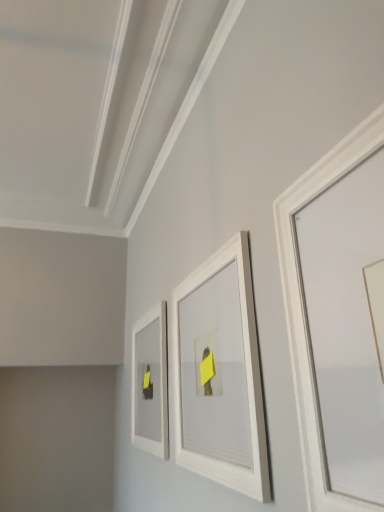
What do you see at coordinates (220, 374) in the screenshot? The width and height of the screenshot is (384, 512). I see `white matte picture frame at center, the second picture frame positioned from the front` at bounding box center [220, 374].

Locate an element on the screen. This screenshot has height=512, width=384. white matte picture frame at center-left, the 1th picture frame positioned from the back is located at coordinates (150, 382).

In order to face white matte picture frame at center-left, marked as the 3th picture frame in a right-to-left arrangement, should I rotate leftwards or rightwards?

To align with it, rotate left about 6.307°.

In order to click on white matte picture frame at center, which is the 2th picture frame in back-to-front order in this screenshot , I will do `click(220, 374)`.

Based on the photo, are white matte picture frame at center-left, the 1th picture frame positioned from the back, and white matte picture frame at upper right, which is the third picture frame from left to right, making contact?

There is a gap between white matte picture frame at center-left, the 1th picture frame positioned from the back, and white matte picture frame at upper right, which is the third picture frame from left to right.

Who is bigger, white matte picture frame at center-left, marked as the 3th picture frame in a right-to-left arrangement, or white matte picture frame at upper right, the third picture frame viewed from the back?

white matte picture frame at center-left, marked as the 3th picture frame in a right-to-left arrangement.

Which is behind, white matte picture frame at center-left, marked as the 3th picture frame in a right-to-left arrangement, or white matte picture frame at upper right, the third picture frame viewed from the back?

Positioned behind is white matte picture frame at center-left, marked as the 3th picture frame in a right-to-left arrangement.

From the image's perspective, is white matte picture frame at center, placed as the 2th picture frame when sorted from right to left, beneath white matte picture frame at upper right, which is the third picture frame from left to right?

Indeed, from the image's perspective, white matte picture frame at center, placed as the 2th picture frame when sorted from right to left, is shown beneath white matte picture frame at upper right, which is the third picture frame from left to right.

Is white matte picture frame at center, which is the 2th picture frame in back-to-front order, far from white matte picture frame at upper right, which is the third picture frame from left to right?

white matte picture frame at center, which is the 2th picture frame in back-to-front order, is near white matte picture frame at upper right, which is the third picture frame from left to right, not far away.

Is white matte picture frame at center, the second picture frame positioned from the front, aimed at white matte picture frame at upper right, which appears as the first picture frame when viewed from the front?

No, white matte picture frame at center, the second picture frame positioned from the front, is not facing towards white matte picture frame at upper right, which appears as the first picture frame when viewed from the front.

At what (x,y) coordinates should I click in order to perform the action: click on picture frame in front of the white matte picture frame at center, placed as the 2th picture frame when sorted from right to left. Please return your answer as a coordinate pair (x, y). This screenshot has height=512, width=384. Looking at the image, I should click on (303, 306).

Which is more to the left, white matte picture frame at center-left, marked as the 3th picture frame in a right-to-left arrangement, or white matte picture frame at center, which is the 2th picture frame in back-to-front order?

From the viewer's perspective, white matte picture frame at center-left, marked as the 3th picture frame in a right-to-left arrangement, appears more on the left side.

How different are the orientations of white matte picture frame at center-left, which is counted as the 1th picture frame, starting from the left, and white matte picture frame at center, arranged as the 2th picture frame when viewed from the left, in degrees?

There is a 0.123-degree angle between the facing directions of white matte picture frame at center-left, which is counted as the 1th picture frame, starting from the left, and white matte picture frame at center, arranged as the 2th picture frame when viewed from the left.

Where is `the 1st picture frame located above the white matte picture frame at center-left, the 1th picture frame positioned from the back (from a real-world perspective)`? the 1st picture frame located above the white matte picture frame at center-left, the 1th picture frame positioned from the back (from a real-world perspective) is located at coordinates (220, 374).

Is the surface of white matte picture frame at center-left, acting as the third picture frame starting from the front, in direct contact with white matte picture frame at center, the second picture frame positioned from the front?

white matte picture frame at center-left, acting as the third picture frame starting from the front, is not next to white matte picture frame at center, the second picture frame positioned from the front, and they're not touching.

Which of these two, white matte picture frame at upper right, the third picture frame viewed from the back, or white matte picture frame at center, arranged as the 2th picture frame when viewed from the left, stands taller?

With more height is white matte picture frame at center, arranged as the 2th picture frame when viewed from the left.

From the image's perspective, which one is positioned lower, white matte picture frame at upper right, which appears as the first picture frame when viewed from the front, or white matte picture frame at center, which is the 2th picture frame in back-to-front order?

white matte picture frame at center, which is the 2th picture frame in back-to-front order.

This screenshot has width=384, height=512. I want to click on picture frame above the white matte picture frame at center, which is the 2th picture frame in back-to-front order (from a real-world perspective), so click(x=303, y=306).

Looking at this image, which of these two, white matte picture frame at upper right, which is the third picture frame from left to right, or white matte picture frame at center, placed as the 2th picture frame when sorted from right to left, is wider?

Wider between the two is white matte picture frame at center, placed as the 2th picture frame when sorted from right to left.

Are white matte picture frame at center, arranged as the 2th picture frame when viewed from the left, and white matte picture frame at center-left, the 1th picture frame positioned from the back, beside each other?

No, white matte picture frame at center, arranged as the 2th picture frame when viewed from the left, is not beside white matte picture frame at center-left, the 1th picture frame positioned from the back.

Considering the sizes of objects white matte picture frame at center, which is the 2th picture frame in back-to-front order, and white matte picture frame at center-left, marked as the 3th picture frame in a right-to-left arrangement, in the image provided, who is smaller, white matte picture frame at center, which is the 2th picture frame in back-to-front order, or white matte picture frame at center-left, marked as the 3th picture frame in a right-to-left arrangement,?

white matte picture frame at center-left, marked as the 3th picture frame in a right-to-left arrangement, is smaller.

Is white matte picture frame at center, which is the 2th picture frame in back-to-front order, looking in the opposite direction of white matte picture frame at center-left, marked as the 3th picture frame in a right-to-left arrangement?

That's not correct — white matte picture frame at center, which is the 2th picture frame in back-to-front order, is not looking away from white matte picture frame at center-left, marked as the 3th picture frame in a right-to-left arrangement.

Is white matte picture frame at center, arranged as the 2th picture frame when viewed from the left, inside the boundaries of white matte picture frame at center-left, the 1th picture frame positioned from the back, or outside?

white matte picture frame at center, arranged as the 2th picture frame when viewed from the left, is outside white matte picture frame at center-left, the 1th picture frame positioned from the back.

Is white matte picture frame at upper right, the first picture frame when ordered from right to left, outside of white matte picture frame at center-left, marked as the 3th picture frame in a right-to-left arrangement?

Yes, white matte picture frame at upper right, the first picture frame when ordered from right to left, is outside of white matte picture frame at center-left, marked as the 3th picture frame in a right-to-left arrangement.

Which object is positioned more to the left, white matte picture frame at upper right, which is the third picture frame from left to right, or white matte picture frame at center-left, which is counted as the 1th picture frame, starting from the left?

Positioned to the left is white matte picture frame at center-left, which is counted as the 1th picture frame, starting from the left.

Is white matte picture frame at upper right, the third picture frame viewed from the back, taller or shorter than white matte picture frame at center-left, acting as the third picture frame starting from the front?

Clearly, white matte picture frame at upper right, the third picture frame viewed from the back, is shorter compared to white matte picture frame at center-left, acting as the third picture frame starting from the front.

Between white matte picture frame at upper right, the third picture frame viewed from the back, and white matte picture frame at center-left, marked as the 3th picture frame in a right-to-left arrangement, which one has larger size?

white matte picture frame at center-left, marked as the 3th picture frame in a right-to-left arrangement.

Image resolution: width=384 pixels, height=512 pixels. What are the coordinates of `the 2nd picture frame counting from the right of the white matte picture frame at center-left, marked as the 3th picture frame in a right-to-left arrangement` in the screenshot? It's located at (303, 306).

This screenshot has width=384, height=512. I want to click on the 1st picture frame behind when counting from the white matte picture frame at upper right, which appears as the first picture frame when viewed from the front, so click(x=220, y=374).

Looking at the image, which one is located further to white matte picture frame at center, the second picture frame positioned from the front, white matte picture frame at upper right, the first picture frame when ordered from right to left, or white matte picture frame at center-left, which is counted as the 1th picture frame, starting from the left?

white matte picture frame at center-left, which is counted as the 1th picture frame, starting from the left.

Based on their spatial positions, is white matte picture frame at center, the second picture frame positioned from the front, or white matte picture frame at upper right, the third picture frame viewed from the back, further from white matte picture frame at center-left, the 1th picture frame positioned from the back?

Based on the image, white matte picture frame at upper right, the third picture frame viewed from the back, appears to be further to white matte picture frame at center-left, the 1th picture frame positioned from the back.

Which object lies further to the anchor point white matte picture frame at center-left, which is counted as the 1th picture frame, starting from the left, white matte picture frame at upper right, the first picture frame when ordered from right to left, or white matte picture frame at center, which is the 2th picture frame in back-to-front order?

Among the two, white matte picture frame at upper right, the first picture frame when ordered from right to left, is located further to white matte picture frame at center-left, which is counted as the 1th picture frame, starting from the left.

Looking at the image, which one is located further to white matte picture frame at center, the second picture frame positioned from the front, white matte picture frame at center-left, marked as the 3th picture frame in a right-to-left arrangement, or white matte picture frame at upper right, the third picture frame viewed from the back?

white matte picture frame at center-left, marked as the 3th picture frame in a right-to-left arrangement.

Which object lies further to the anchor point white matte picture frame at upper right, the first picture frame when ordered from right to left, white matte picture frame at center, placed as the 2th picture frame when sorted from right to left, or white matte picture frame at center-left, acting as the third picture frame starting from the front?

Based on the image, white matte picture frame at center-left, acting as the third picture frame starting from the front, appears to be further to white matte picture frame at upper right, the first picture frame when ordered from right to left.

From the image, which object appears to be farther from white matte picture frame at upper right, which appears as the first picture frame when viewed from the front, white matte picture frame at center-left, which is counted as the 1th picture frame, starting from the left, or white matte picture frame at center, arranged as the 2th picture frame when viewed from the left?

The object further to white matte picture frame at upper right, which appears as the first picture frame when viewed from the front, is white matte picture frame at center-left, which is counted as the 1th picture frame, starting from the left.

I want to click on picture frame positioned between white matte picture frame at upper right, the third picture frame viewed from the back, and white matte picture frame at center-left, marked as the 3th picture frame in a right-to-left arrangement, from near to far, so click(x=220, y=374).